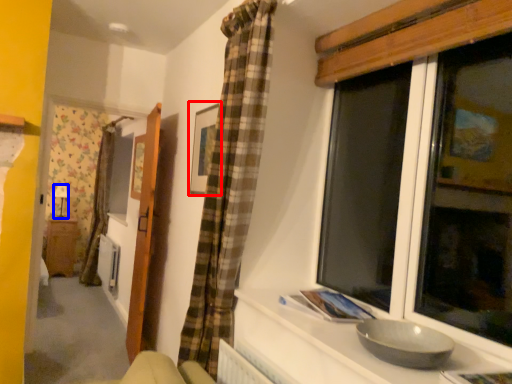
Question: Which object is further to the camera taking this photo, picture frame (highlighted by a red box) or lamp (highlighted by a blue box)?

Choices:
 (A) picture frame
 (B) lamp

Answer: (B)